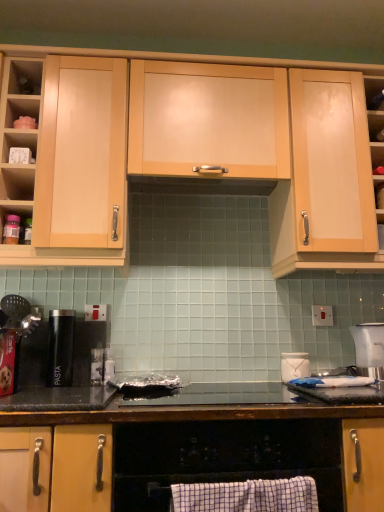
Question: Considering the positions of matte wood cabinet at center, marked as the fourth cabinetry in a bottom-to-top arrangement, and matte wood cabinet at left, which is counted as the 3th cabinetry, starting from the bottom, in the image, is matte wood cabinet at center, marked as the fourth cabinetry in a bottom-to-top arrangement, bigger or smaller than matte wood cabinet at left, which is counted as the 3th cabinetry, starting from the bottom,?

Choices:
 (A) small
 (B) big

Answer: (A)

Question: From the image's perspective, is matte wood cabinet at center, marked as the fourth cabinetry in a bottom-to-top arrangement, located above or below matte wood cabinet at left, the 2th cabinetry in the top-to-bottom sequence?

Choices:
 (A) above
 (B) below

Answer: (A)

Question: Which is farther from the black matte pasta canister at left?

Choices:
 (A) white glossy jar at upper right
 (B) matte wood cabinet at left, which is counted as the 3th cabinetry, starting from the bottom
 (C) white plastic electric outlet at center right
 (D) matte wood cabinet at center, marked as the fourth cabinetry in a bottom-to-top arrangement
 (E) white plastic clock at upper left, marked as the second shelf in a right-to-left arrangement

Answer: (C)

Question: Which is nearer to the white plastic electric outlet at center right?

Choices:
 (A) light wood cabinet at upper right, marked as the third cabinetry in a top-to-bottom arrangement
 (B) white plastic blender at right
 (C) wooden shelf at upper right, which is counted as the first shelf, starting from the bottom
 (D) matte wood cabinet at left, the 2th cabinetry in the top-to-bottom sequence
 (E) white plastic clock at upper left, marked as the second shelf in a left-to-right arrangement

Answer: (B)